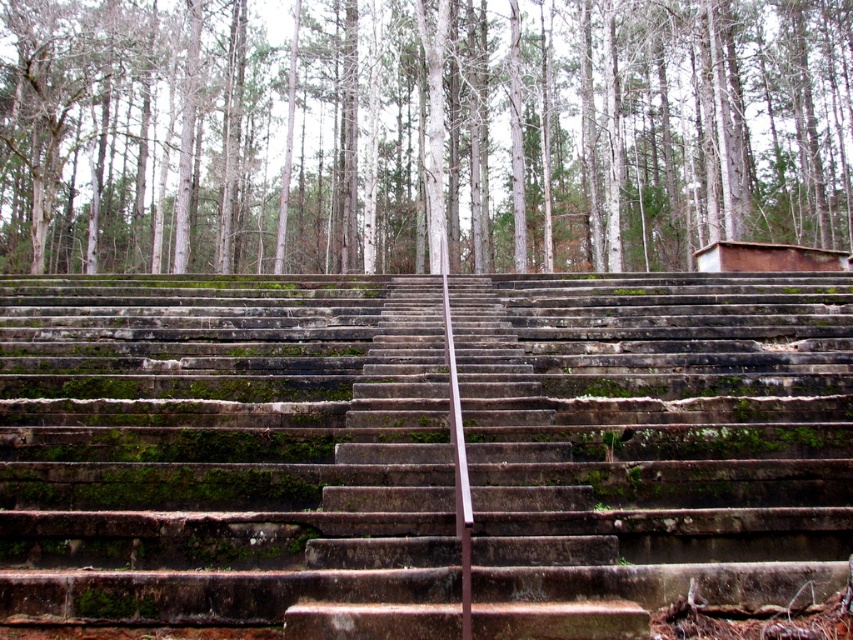
You are standing at the bottom of the stone steps leading into the forest. You notice a point marked at coordinates (224, 458). What object does this point correspond to?

The point at coordinates (224, 458) corresponds to the dark gray concrete stairs at center.

You are a hiker trying to navigate the stone steps leading into the forest. You notice the dark gray concrete stairs at center and the white bark trees at upper center. Which object appears larger in the image?

The white bark trees at upper center appear larger than the dark gray concrete stairs at center in the image.

You are a hiker planning to walk from the dark gray concrete stairs at center to the white bark trees at upper center. The trail is narrow and has loose gravel. If the distance between them is exactly 24.60 meters, can you safely walk this path if your maximum comfortable walking distance is 25 meters?

The dark gray concrete stairs at center is 24.60 meters from the white bark trees at upper center. Since your maximum comfortable walking distance is 25 meters, you can safely walk this path as the distance is within your limit.